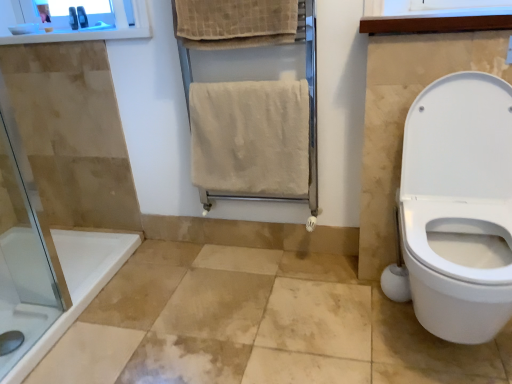
Question: Which direction should I rotate to look at beige textured towel at upper center, the 2th bath towel ordered from the bottom?

Choices:
 (A) right
 (B) left

Answer: (B)

Question: From a real-world perspective, is white wood window frame at upper right positioned over metallic gray razor at upper left, arranged as the first toiletry when viewed from the left, based on gravity?

Choices:
 (A) yes
 (B) no

Answer: (B)

Question: Can you confirm if white wood window frame at upper right is thinner than metallic gray razor at upper left, which appears as the second toiletry when viewed from the right?

Choices:
 (A) no
 (B) yes

Answer: (A)

Question: Can you confirm if white wood window frame at upper right is smaller than metallic gray razor at upper left, which appears as the second toiletry when viewed from the right?

Choices:
 (A) yes
 (B) no

Answer: (B)

Question: Does white wood window frame at upper right turn towards metallic gray razor at upper left, arranged as the first toiletry when viewed from the left?

Choices:
 (A) yes
 (B) no

Answer: (B)

Question: Is white wood window frame at upper right completely or partially outside of metallic gray razor at upper left, arranged as the first toiletry when viewed from the left?

Choices:
 (A) yes
 (B) no

Answer: (A)

Question: Can you confirm if white wood window frame at upper right is wider than metallic gray razor at upper left, arranged as the first toiletry when viewed from the left?

Choices:
 (A) no
 (B) yes

Answer: (B)

Question: Is white glossy toilet seat at right wider than matte plastic toothbrush at upper left, the 1th toiletry positioned from the right?

Choices:
 (A) yes
 (B) no

Answer: (A)

Question: Is white glossy toilet seat at right closer to the viewer compared to matte plastic toothbrush at upper left, marked as the second toiletry in a left-to-right arrangement?

Choices:
 (A) no
 (B) yes

Answer: (B)

Question: Considering the relative positions of white glossy toilet seat at right and matte plastic toothbrush at upper left, marked as the second toiletry in a left-to-right arrangement, in the image provided, is white glossy toilet seat at right to the right of matte plastic toothbrush at upper left, marked as the second toiletry in a left-to-right arrangement, from the viewer's perspective?

Choices:
 (A) no
 (B) yes

Answer: (B)

Question: From a real-world perspective, is white glossy toilet seat at right over matte plastic toothbrush at upper left, the 1th toiletry positioned from the right?

Choices:
 (A) yes
 (B) no

Answer: (B)

Question: Can we say white glossy toilet seat at right lies outside matte plastic toothbrush at upper left, marked as the second toiletry in a left-to-right arrangement?

Choices:
 (A) no
 (B) yes

Answer: (B)

Question: From the image's perspective, is white glossy toilet seat at right below matte plastic toothbrush at upper left, marked as the second toiletry in a left-to-right arrangement?

Choices:
 (A) no
 (B) yes

Answer: (B)

Question: Is beige towel rack at center to the right of beige textured towel at upper center, the 2th bath towel ordered from the bottom, from the viewer's perspective?

Choices:
 (A) no
 (B) yes

Answer: (B)